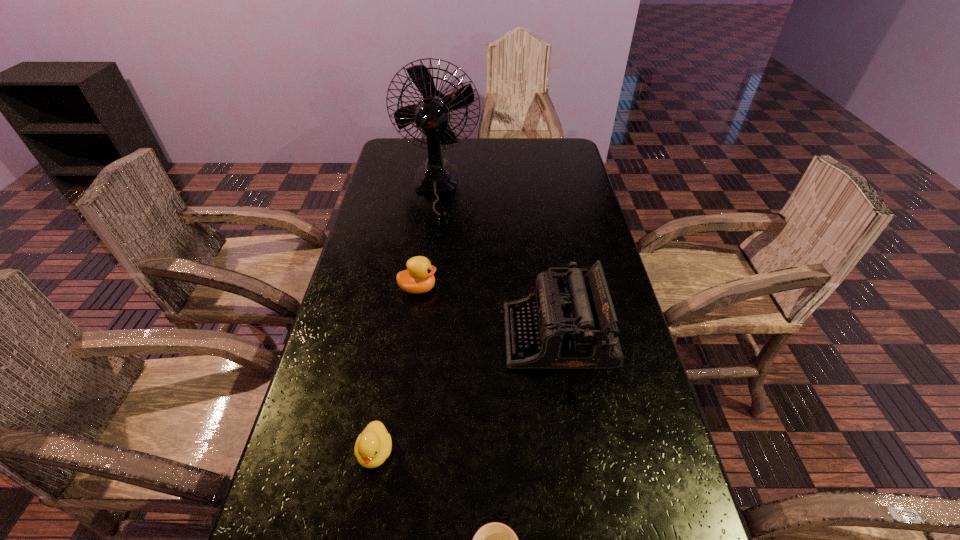
Locate an element on the screen. The image size is (960, 540). blank space that satisfies the following two spatial constraints: 1. in front of the farthest object, indicating the direction of air flow; 2. on the face of the second farthest object is located at coordinates (422, 288).

Where is `blank area in the image that satisfies the following two spatial constraints: 1. in front of the fan, indicating the direction of air flow; 2. on the face of the third tallest object`? This screenshot has height=540, width=960. blank area in the image that satisfies the following two spatial constraints: 1. in front of the fan, indicating the direction of air flow; 2. on the face of the third tallest object is located at coordinates (422, 288).

This screenshot has width=960, height=540. In order to click on vacant space that satisfies the following two spatial constraints: 1. on the face of the third shortest object; 2. on the beak of the second nearest object in this screenshot , I will do `click(396, 452)`.